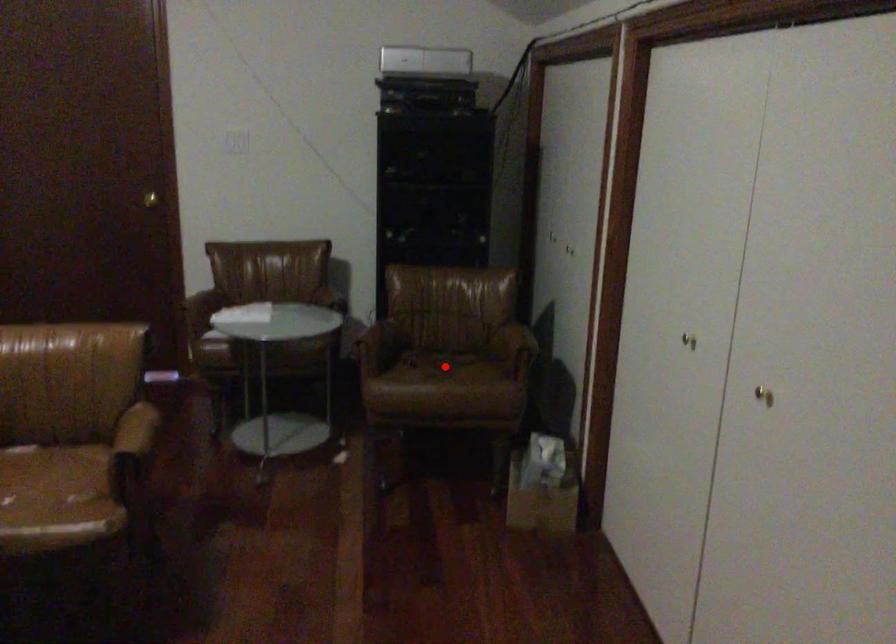
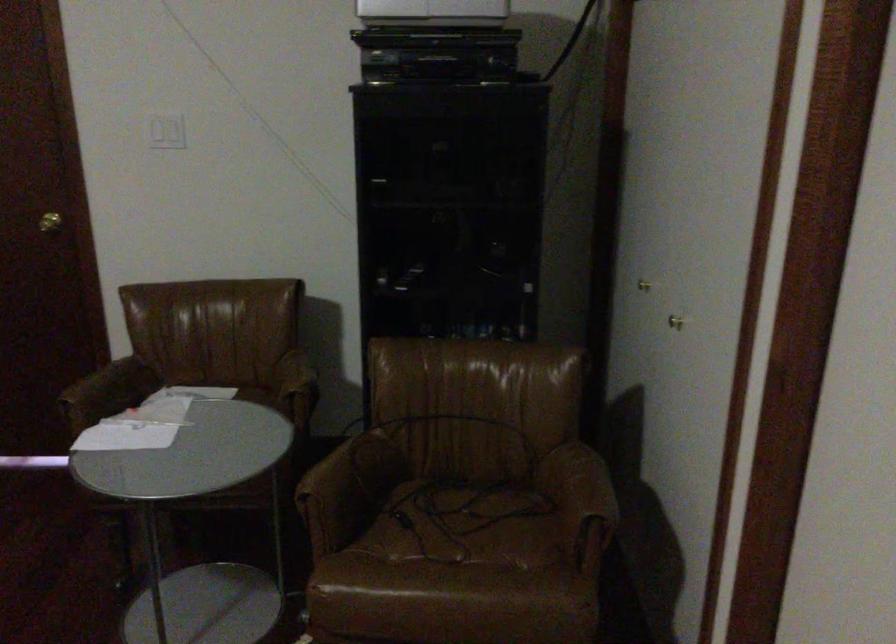
In the second image, find the point that corresponds to the highlighted location in the first image.

(464, 525)